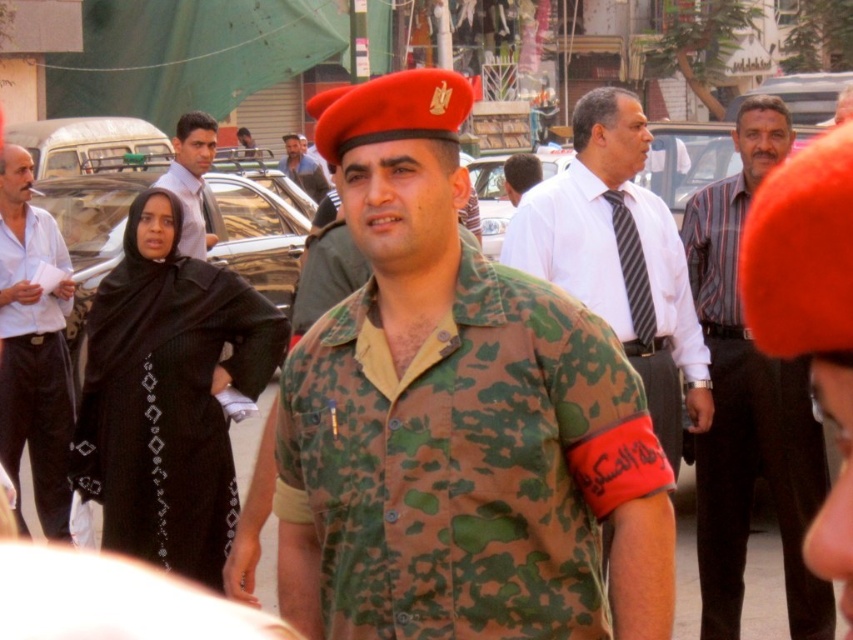
In the scene shown: You are a photographer trying to capture a clear shot of the white shirt with tie at center and the matte white shirt at upper left. Which one appears smaller in the photo?

The white shirt with tie at center appears smaller in the photo because it is smaller than the matte white shirt at upper left.

You are a photographer trying to capture the central figure in the scene. You notice the striped fabric tie at center and the matte black shirt at center. Which of these items is positioned lower on the central figure?

The striped fabric tie at center is positioned below the matte black shirt at center, so it is lower on the central figure.

In the scene, you notice a man in a military uniform walking through a crowd. He has a striped fabric tie at center and a matte black shirt at center. Which of these two items is narrower in width?

The striped fabric tie at center is thinner than the matte black shirt at center, so the striped fabric tie at center is narrower in width.